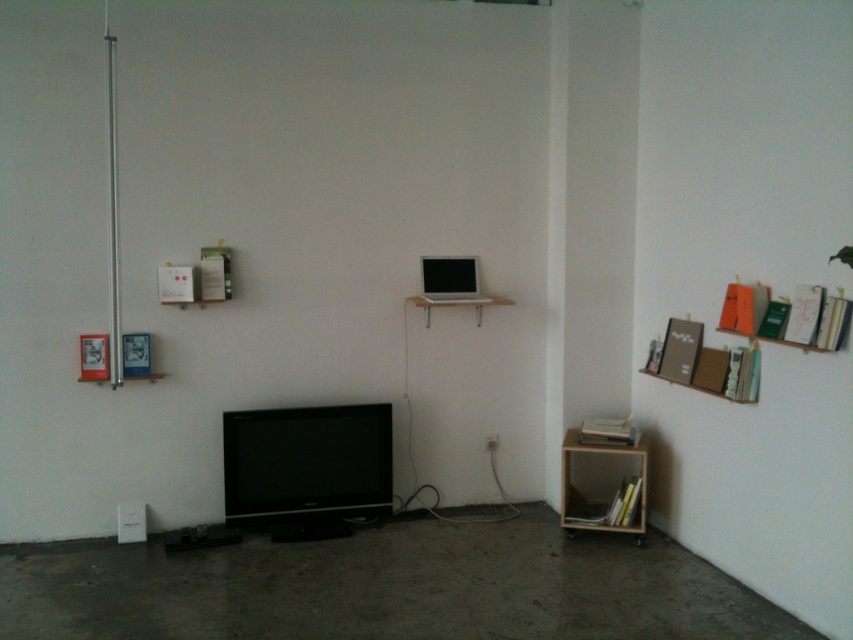
You are moving a large piece of furniture into the room and need to know the vertical arrangement of the black glossy flat screen tv at center and the wooden bookshelf at lower right. Which one is positioned higher up?

The black glossy flat screen tv at center is positioned higher up than the wooden bookshelf at lower right.